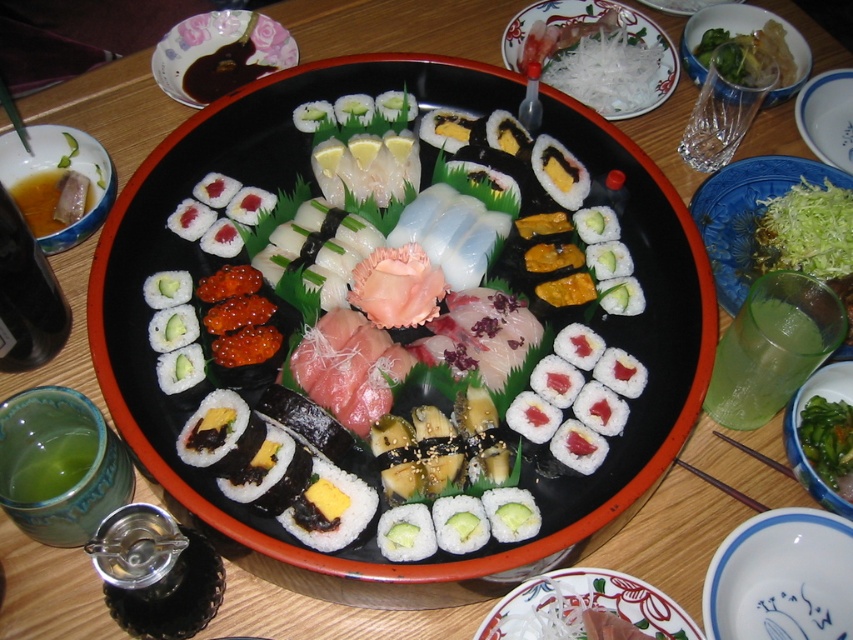
Looking at the sushi platter, which object is thinner between the green leafy vegetable at right and the white shredded vegetable at upper center?

The green leafy vegetable at right is thinner than the white shredded vegetable at upper center.

You are a photographer taking a closeup shot of the sushi platter. You notice two points on the platter surface at coordinates point (717, 216) and point (514, 44). Which point is closer to your camera lens?

Point (717, 216) is closer to the camera lens than point (514, 44).

You are a food critic analyzing the arrangement of the sushi platter. Based on the coordinates provided, where exactly is the white rice with nori at center positioned on the platter?

The white rice with nori at center is precisely located at the coordinates point (404, 300).